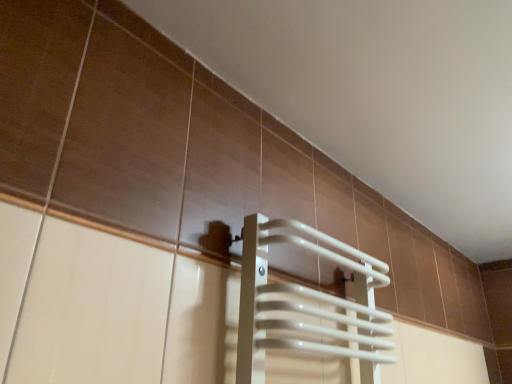
In the scene shown: What is the approximate height of white matte towel rack at center?

white matte towel rack at center is 15.13 inches in height.

The height and width of the screenshot is (384, 512). What are the coordinates of `white matte towel rack at center` in the screenshot? It's located at click(x=307, y=304).

Describe the element at coordinates (307, 304) in the screenshot. This screenshot has width=512, height=384. I see `white matte towel rack at center` at that location.

Where is `white matte towel rack at center`? Image resolution: width=512 pixels, height=384 pixels. white matte towel rack at center is located at coordinates (307, 304).